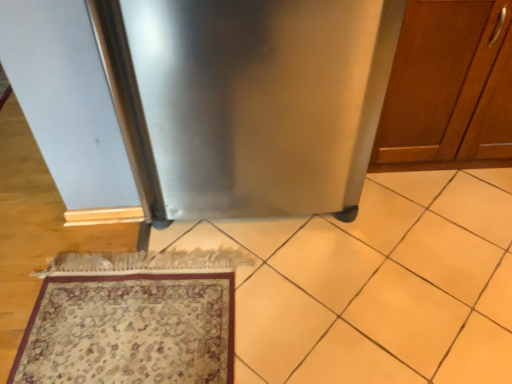
Question: From a real-world perspective, relative to wooden cabinet at right, is stainless steel refrigerator at center vertically above or below?

Choices:
 (A) below
 (B) above

Answer: (B)

Question: Is stainless steel refrigerator at center situated inside wooden cabinet at right or outside?

Choices:
 (A) outside
 (B) inside

Answer: (A)

Question: Which object is the closest to the carpeted rug at lower left?

Choices:
 (A) stainless steel refrigerator at center
 (B) wooden cabinet at right

Answer: (A)

Question: Which object is the farthest from the wooden cabinet at right?

Choices:
 (A) carpeted rug at lower left
 (B) stainless steel refrigerator at center

Answer: (A)